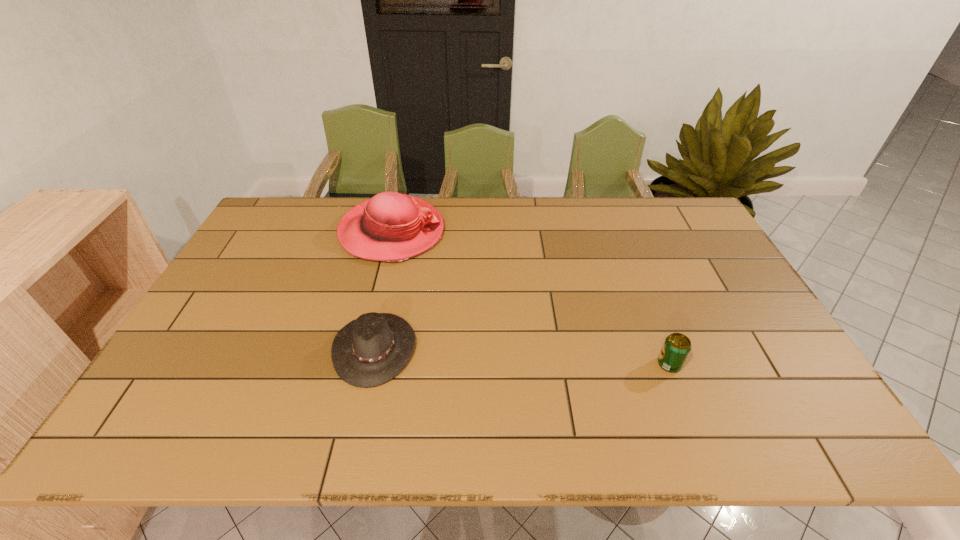
In the image, there is a desktop. Where is `vacant space at the right edge`? The image size is (960, 540). vacant space at the right edge is located at coordinates (743, 310).

This screenshot has height=540, width=960. In order to click on free spot at the near left corner of the desktop in this screenshot , I will do `click(147, 422)`.

At what (x,y) coordinates should I click in order to perform the action: click on free space between the shorter hat and the rightmost object. Please return your answer as a coordinate pair (x, y). Looking at the image, I should click on (522, 356).

Find the location of `free point between the rightmost object and the farther hat`. free point between the rightmost object and the farther hat is located at coordinates (531, 298).

Find the location of a particular element. This screenshot has width=960, height=540. vacant point located between the farther hat and the beer can is located at coordinates (531, 298).

You are a GUI agent. You are given a task and a screenshot of the screen. Output one action in this format:
    pyautogui.click(x=<x>, y=<y>)
    Task: Click on the blank region between the farther hat and the shorter hat
    
    Given the screenshot: What is the action you would take?
    tap(383, 290)

Find the location of a particular element. Image resolution: width=960 pixels, height=540 pixels. free space between the farther hat and the shorter hat is located at coordinates (383, 290).

This screenshot has height=540, width=960. What are the coordinates of `vacant area that lies between the beer can and the shorter hat` in the screenshot? It's located at (522, 356).

At what (x,y) coordinates should I click in order to perform the action: click on free spot between the farther hat and the beer can. Please return your answer as a coordinate pair (x, y). Looking at the image, I should click on (531, 298).

You are a GUI agent. You are given a task and a screenshot of the screen. Output one action in this format:
    pyautogui.click(x=<x>, y=<y>)
    Task: Click on the free space between the rightmost object and the shorter hat
    
    Given the screenshot: What is the action you would take?
    pyautogui.click(x=522, y=356)